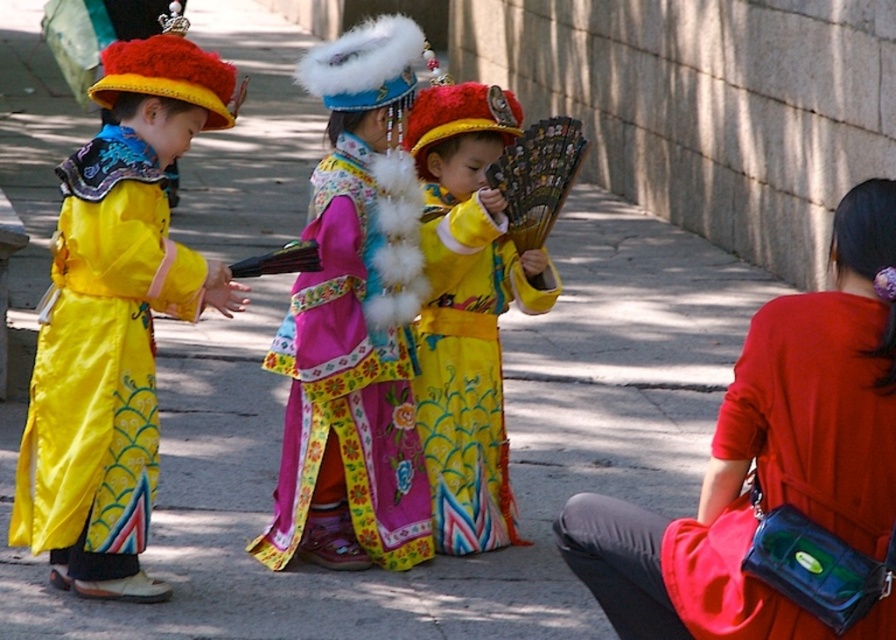
Question: Which object is the closest to the matte yellow costume at center?

Choices:
 (A) matte red shirt at right
 (B) floral satin robe at center
 (C) shiny yellow robe at left

Answer: (B)

Question: Where is matte red shirt at right located in relation to shiny yellow robe at left in the image?

Choices:
 (A) left
 (B) right

Answer: (B)

Question: Which point appears closest to the camera in this image?

Choices:
 (A) (126, 275)
 (B) (386, 497)

Answer: (A)

Question: Is matte red shirt at right positioned in front of shiny yellow robe at left?

Choices:
 (A) yes
 (B) no

Answer: (A)

Question: Which point appears closest to the camera in this image?

Choices:
 (A) (506, 308)
 (B) (138, 340)
 (C) (291, 305)
 (D) (892, 621)

Answer: (D)

Question: Is floral satin robe at center to the right of matte yellow costume at center from the viewer's perspective?

Choices:
 (A) yes
 (B) no

Answer: (B)